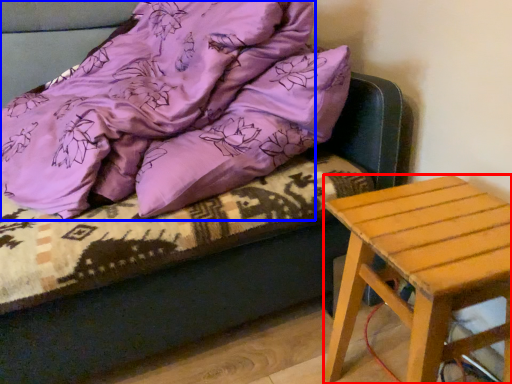
Question: Which point is closer to the camera, stool (highlighted by a red box) or blanket (highlighted by a blue box)?

Choices:
 (A) stool
 (B) blanket

Answer: (B)